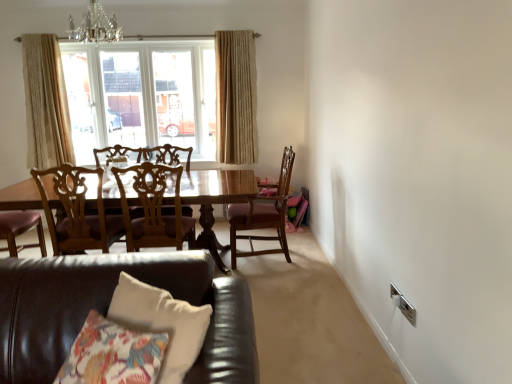
The image size is (512, 384). What do you see at coordinates (95, 26) in the screenshot?
I see `crystal glass chandelier at upper center` at bounding box center [95, 26].

Where is `clear glass window at upper center`? The image size is (512, 384). clear glass window at upper center is located at coordinates (141, 96).

What do you see at coordinates (236, 97) in the screenshot?
I see `beige textured curtain at upper center, positioned as the 2th curtain in left-to-right order` at bounding box center [236, 97].

Find the location of a particular element. The height and width of the screenshot is (384, 512). wooden chair at center, the 2th chair when ordered from right to left is located at coordinates (154, 208).

Identify the location of beige textured curtain at left, arranged as the 1th curtain when viewed from the left. This screenshot has width=512, height=384. (46, 103).

Looking at this image, from a real-world perspective, who is located lower, beige textured curtain at left, positioned as the second curtain in right-to-left order, or wooden chair at center, marked as the first chair in a right-to-left arrangement?

In real-world perspective, wooden chair at center, marked as the first chair in a right-to-left arrangement, is lower.

From the image's perspective, which one is positioned lower, beige textured curtain at left, positioned as the second curtain in right-to-left order, or wooden chair at center, which appears as the 3th chair when viewed from the left?

wooden chair at center, which appears as the 3th chair when viewed from the left, from the image's perspective.

Which point is more distant from viewer, (57, 56) or (249, 211)?

Point (57, 56)

Which object is positioned more to the left, wooden chair at center, which appears as the 3th chair when viewed from the left, or beige textured curtain at upper center, which appears as the 1th curtain when viewed from the right?

From the viewer's perspective, beige textured curtain at upper center, which appears as the 1th curtain when viewed from the right, appears more on the left side.

Is wooden chair at center, marked as the first chair in a right-to-left arrangement, situated inside beige textured curtain at upper center, positioned as the 2th curtain in left-to-right order, or outside?

wooden chair at center, marked as the first chair in a right-to-left arrangement, is located beyond the bounds of beige textured curtain at upper center, positioned as the 2th curtain in left-to-right order.

From the image's perspective, between wooden chair at center, marked as the first chair in a right-to-left arrangement, and beige textured curtain at upper center, which appears as the 1th curtain when viewed from the right, who is located below?

wooden chair at center, marked as the first chair in a right-to-left arrangement, is shown below in the image.

Does wooden chair at center, marked as the first chair in a right-to-left arrangement, have a greater width compared to beige textured curtain at upper center, which appears as the 1th curtain when viewed from the right?

Yes.

Is crystal glass chandelier at upper center to the left of wooden chair with carved backrest at center, the first chair from the left, from the viewer's perspective?

In fact, crystal glass chandelier at upper center is to the right of wooden chair with carved backrest at center, the first chair from the left.

Which of these two, crystal glass chandelier at upper center or wooden chair with carved backrest at center, which appears as the third chair when viewed from the right, stands taller?

wooden chair with carved backrest at center, which appears as the third chair when viewed from the right, is taller.

Which object is closer to the camera, crystal glass chandelier at upper center or wooden chair with carved backrest at center, which appears as the third chair when viewed from the right?

Positioned in front is wooden chair with carved backrest at center, which appears as the third chair when viewed from the right.

Consider the image. Does crystal glass chandelier at upper center contain wooden chair with carved backrest at center, the first chair from the left?

No, wooden chair with carved backrest at center, the first chair from the left, is not a part of crystal glass chandelier at upper center.

Looking at this image, measure the distance from beige textured curtain at upper center, which appears as the 1th curtain when viewed from the right, to wooden chair at center, marked as the first chair in a right-to-left arrangement.

The distance of beige textured curtain at upper center, which appears as the 1th curtain when viewed from the right, from wooden chair at center, marked as the first chair in a right-to-left arrangement, is 3.90 feet.

Consider the image. From a real-world perspective, which is physically above, beige textured curtain at upper center, positioned as the 2th curtain in left-to-right order, or wooden chair at center, which appears as the 3th chair when viewed from the left?

beige textured curtain at upper center, positioned as the 2th curtain in left-to-right order, from a real-world perspective.

Is beige textured curtain at upper center, which appears as the 1th curtain when viewed from the right, not near wooden chair at center, which appears as the 3th chair when viewed from the left?

That's right, there is a large distance between beige textured curtain at upper center, which appears as the 1th curtain when viewed from the right, and wooden chair at center, which appears as the 3th chair when viewed from the left.

Which of these two, beige textured curtain at upper center, which appears as the 1th curtain when viewed from the right, or wooden chair at center, which appears as the 3th chair when viewed from the left, is wider?

wooden chair at center, which appears as the 3th chair when viewed from the left, is wider.

Is crystal glass chandelier at upper center not close to clear glass window at upper center?

Yes, crystal glass chandelier at upper center and clear glass window at upper center are quite far apart.

Considering the positions of objects crystal glass chandelier at upper center and clear glass window at upper center in the image provided, who is behind, crystal glass chandelier at upper center or clear glass window at upper center?

clear glass window at upper center.

Is crystal glass chandelier at upper center bigger or smaller than clear glass window at upper center?

crystal glass chandelier at upper center is smaller than clear glass window at upper center.

Can you confirm if wooden chair at center, the 2th chair when ordered from right to left, is shorter than wooden chair at center, which appears as the 3th chair when viewed from the left?

Correct, wooden chair at center, the 2th chair when ordered from right to left, is not as tall as wooden chair at center, which appears as the 3th chair when viewed from the left.

Is wooden chair at center, marked as the first chair in a right-to-left arrangement, located within wooden chair at center, positioned as the 2th chair in left-to-right order?

No, wooden chair at center, marked as the first chair in a right-to-left arrangement, is not surrounded by wooden chair at center, positioned as the 2th chair in left-to-right order.

From a real-world perspective, does wooden chair at center, the 2th chair when ordered from right to left, stand above wooden chair at center, which appears as the 3th chair when viewed from the left?

Yes, from a real-world perspective, wooden chair at center, the 2th chair when ordered from right to left, is above wooden chair at center, which appears as the 3th chair when viewed from the left.

Is wooden chair at center, positioned as the 2th chair in left-to-right order, wider than wooden chair at center, which appears as the 3th chair when viewed from the left?

Yes.

Is beige textured curtain at upper center, which appears as the 1th curtain when viewed from the right, oriented towards beige textured curtain at left, arranged as the 1th curtain when viewed from the left?

No.

Is beige textured curtain at upper center, positioned as the 2th curtain in left-to-right order, completely or partially outside of beige textured curtain at left, arranged as the 1th curtain when viewed from the left?

Absolutely, beige textured curtain at upper center, positioned as the 2th curtain in left-to-right order, is external to beige textured curtain at left, arranged as the 1th curtain when viewed from the left.

Which point is more distant from viewer, [246,107] or [59,118]?

The point [246,107] is farther from the camera.

From the image's perspective, starting from the beige textured curtain at left, positioned as the second curtain in right-to-left order, which chair is the 1st one below? Please provide its 2D coordinates.

[(263, 215)]

Image resolution: width=512 pixels, height=384 pixels. Find the location of `the 1st curtain counting from the left of the wooden chair at center, marked as the first chair in a right-to-left arrangement`. the 1st curtain counting from the left of the wooden chair at center, marked as the first chair in a right-to-left arrangement is located at coordinates (236, 97).

From the picture: When comparing their distances from beige textured curtain at upper center, which appears as the 1th curtain when viewed from the right, does wooden chair with carved backrest at center, which appears as the third chair when viewed from the right, or wooden chair at center, the 2th chair when ordered from right to left, seem further?

Based on the image, wooden chair with carved backrest at center, which appears as the third chair when viewed from the right, appears to be further to beige textured curtain at upper center, which appears as the 1th curtain when viewed from the right.

Looking at the image, which one is located closer to leather couch at lower left, crystal glass chandelier at upper center or wooden chair at center, the 2th chair when ordered from right to left?

wooden chair at center, the 2th chair when ordered from right to left, is positioned closer to the anchor leather couch at lower left.

From the image, which object appears to be nearer to beige textured curtain at upper center, positioned as the 2th curtain in left-to-right order, clear glass window at upper center or wooden chair with carved backrest at center, the first chair from the left?

clear glass window at upper center is closer to beige textured curtain at upper center, positioned as the 2th curtain in left-to-right order.

When comparing their distances from clear glass window at upper center, does wooden chair at center, marked as the first chair in a right-to-left arrangement, or beige textured curtain at upper center, which appears as the 1th curtain when viewed from the right, seem further?

Among the two, wooden chair at center, marked as the first chair in a right-to-left arrangement, is located further to clear glass window at upper center.

Estimate the real-world distances between objects in this image. Which object is closer to wooden chair at center, marked as the first chair in a right-to-left arrangement, beige textured curtain at upper center, which appears as the 1th curtain when viewed from the right, or wooden chair at center, the 2th chair when ordered from right to left?

Based on the image, wooden chair at center, the 2th chair when ordered from right to left, appears to be nearer to wooden chair at center, marked as the first chair in a right-to-left arrangement.

Considering their positions, is beige textured curtain at upper center, which appears as the 1th curtain when viewed from the right, positioned further to clear glass window at upper center than wooden chair at center, the 2th chair when ordered from right to left?

wooden chair at center, the 2th chair when ordered from right to left, is positioned further to the anchor clear glass window at upper center.

Considering their positions, is wooden chair at center, the 2th chair when ordered from right to left, positioned further to leather couch at lower left than wooden chair with carved backrest at center, which appears as the third chair when viewed from the right?

wooden chair with carved backrest at center, which appears as the third chair when viewed from the right.

From the image, which object appears to be nearer to wooden chair with carved backrest at center, the first chair from the left, wooden chair at center, marked as the first chair in a right-to-left arrangement, or crystal glass chandelier at upper center?

wooden chair at center, marked as the first chair in a right-to-left arrangement, is closer to wooden chair with carved backrest at center, the first chair from the left.

Where is `chair positioned between crystal glass chandelier at upper center and clear glass window at upper center from near to far`? chair positioned between crystal glass chandelier at upper center and clear glass window at upper center from near to far is located at coordinates 263,215.

Image resolution: width=512 pixels, height=384 pixels. I want to click on chair between wooden chair with carved backrest at center, the first chair from the left, and wooden chair at center, marked as the first chair in a right-to-left arrangement, in the horizontal direction, so click(154, 208).

Find the location of a particular element. This screenshot has width=512, height=384. chair positioned between leather couch at lower left and wooden chair at center, the 2th chair when ordered from right to left, from near to far is located at coordinates (77, 211).

You are a GUI agent. You are given a task and a screenshot of the screen. Output one action in this format:
    pyautogui.click(x=<x>, y=<y>)
    Task: Click on the chair between wooden chair at center, positioned as the 2th chair in left-to-right order, and clear glass window at upper center, along the z-axis
    The height and width of the screenshot is (384, 512).
    Given the screenshot: What is the action you would take?
    pyautogui.click(x=263, y=215)